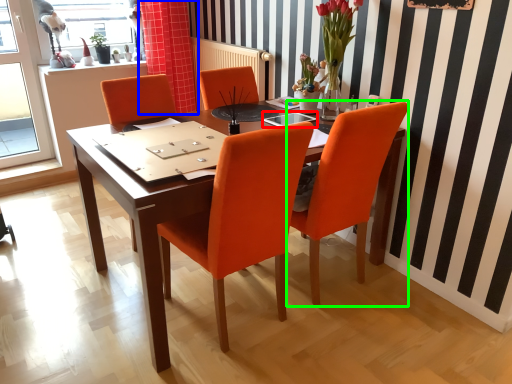
Question: Based on their relative distances, which object is farther from glass table (highlighted by a red box)? Choose from curtain (highlighted by a blue box) and chair (highlighted by a green box).

Choices:
 (A) curtain
 (B) chair

Answer: (A)